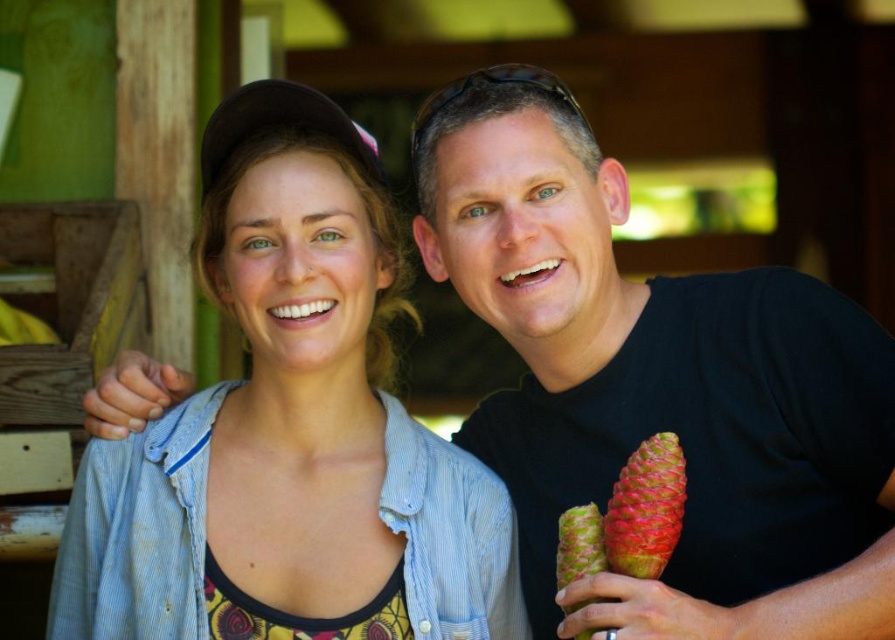
Question: Is black matte pineapple at right to the right of denim jacket at center from the viewer's perspective?

Choices:
 (A) no
 (B) yes

Answer: (B)

Question: Which of the following is the farthest from the observer?

Choices:
 (A) black matte pineapple at right
 (B) denim jacket at center

Answer: (B)

Question: Which point is farther to the camera?

Choices:
 (A) black matte pineapple at right
 (B) denim jacket at center

Answer: (B)

Question: Does black matte pineapple at right appear on the left side of denim jacket at center?

Choices:
 (A) no
 (B) yes

Answer: (A)

Question: Is black matte pineapple at right closer to camera compared to denim jacket at center?

Choices:
 (A) no
 (B) yes

Answer: (B)